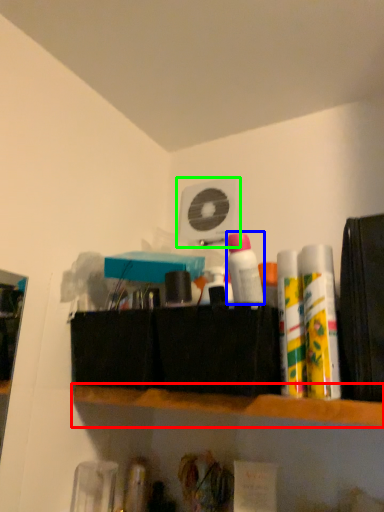
Question: Based on their relative distances, which object is nearer to shelf (highlighted by a red box)? Choose from toiletry (highlighted by a blue box) and fan (highlighted by a green box).

Choices:
 (A) toiletry
 (B) fan

Answer: (A)